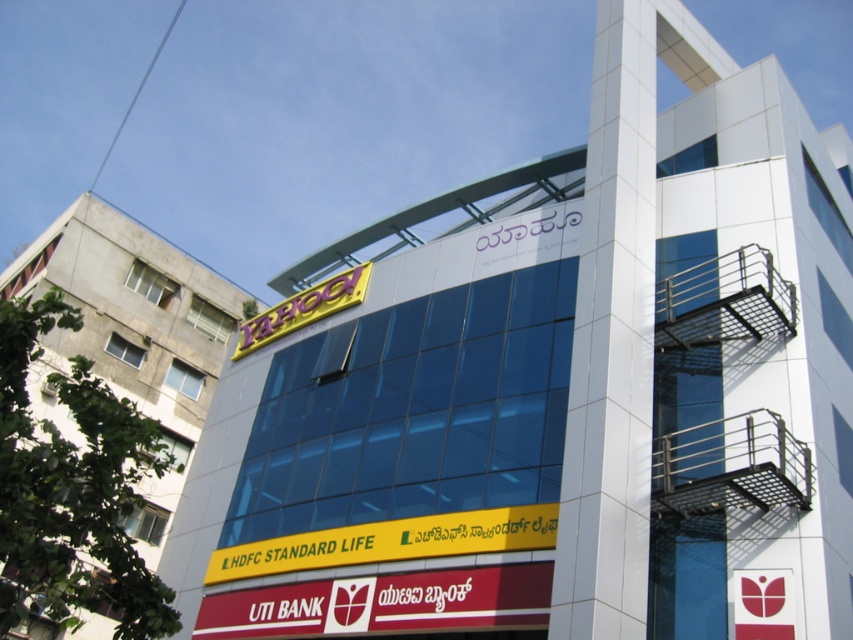
Can you confirm if yellow glossy sign at upper left is smaller than yellow plastic yahoo! sign at upper center?

Actually, yellow glossy sign at upper left might be larger than yellow plastic yahoo! sign at upper center.

Between point (131, 220) and point (279, 317), which one is positioned behind?

Point (131, 220)

Is point (107, 236) closer to camera compared to point (335, 307)?

No, (107, 236) is further to viewer.

I want to click on yellow glossy sign at upper left, so click(x=131, y=333).